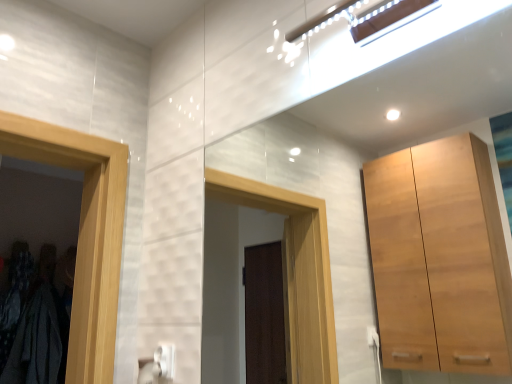
Image resolution: width=512 pixels, height=384 pixels. What are the coordinates of `striped fabric at left` in the screenshot? It's located at (39, 341).

What do you see at coordinates (39, 341) in the screenshot? The height and width of the screenshot is (384, 512). I see `striped fabric at left` at bounding box center [39, 341].

Find the location of a particular element. The width and height of the screenshot is (512, 384). striped fabric at left is located at coordinates (39, 341).